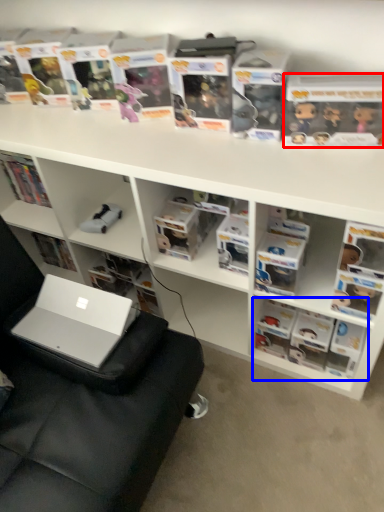
Question: Which object appears closest to the camera in this image, paperback book (highlighted by a red box) or book (highlighted by a blue box)?

Choices:
 (A) paperback book
 (B) book

Answer: (A)